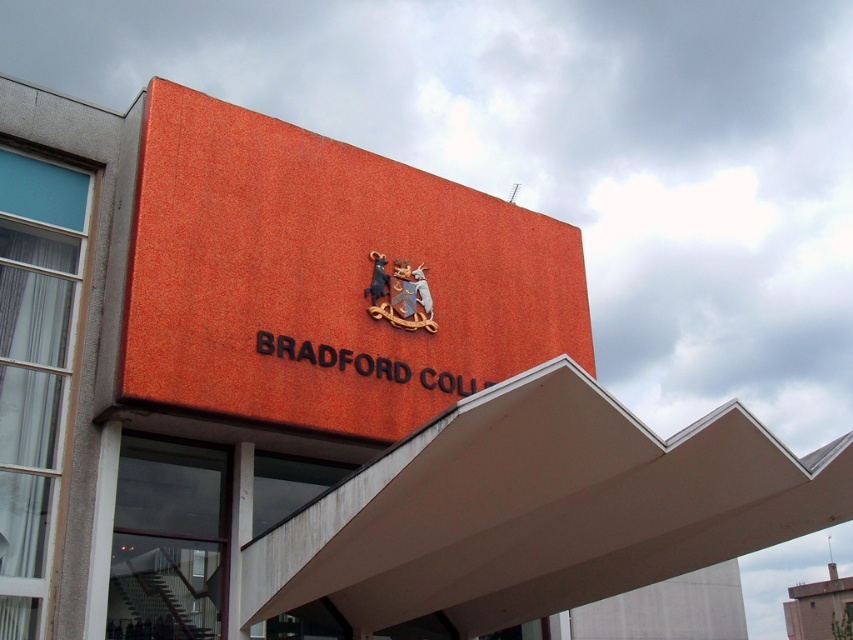
Can you confirm if orange textured sign at center is positioned to the left of wooden coat of arms at center?

Indeed, orange textured sign at center is positioned on the left side of wooden coat of arms at center.

Is orange textured sign at center above wooden coat of arms at center?

Yes, orange textured sign at center is above wooden coat of arms at center.

This screenshot has height=640, width=853. I want to click on orange textured sign at center, so click(x=325, y=276).